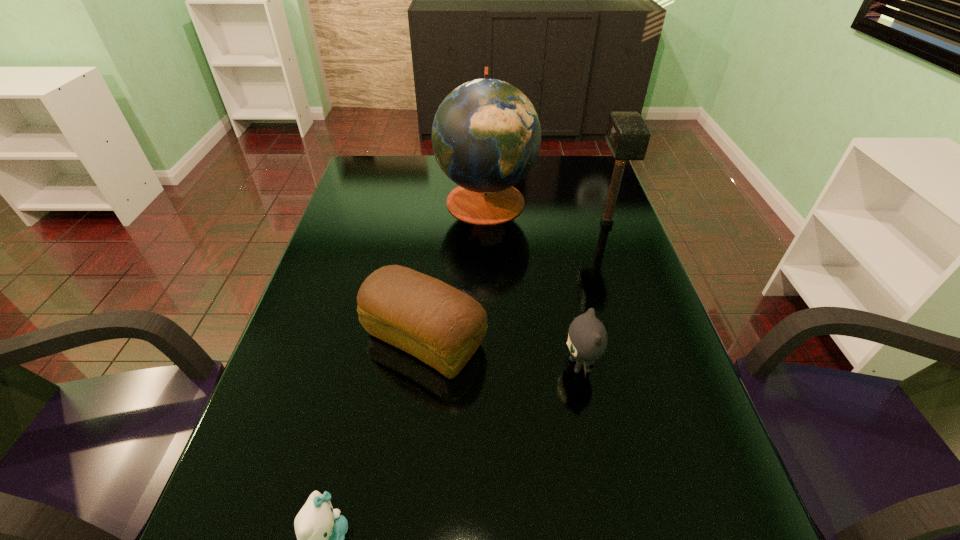
I want to click on globe, so click(x=486, y=135).

This screenshot has width=960, height=540. Find the location of `mallet`. mallet is located at coordinates (627, 135).

This screenshot has height=540, width=960. I want to click on the fourth shortest object, so click(627, 135).

Image resolution: width=960 pixels, height=540 pixels. Find the location of `the third tallest object`. the third tallest object is located at coordinates (442, 326).

The width and height of the screenshot is (960, 540). I want to click on the farther kitten, so click(x=587, y=339).

Where is `the second object from right to left`? the second object from right to left is located at coordinates (587, 339).

At what (x,y) coordinates should I click in order to perform the action: click on vacant space located with the Americas facing the viewer on the tallest object. Please return your answer as a coordinate pair (x, y). This screenshot has width=960, height=540. Looking at the image, I should click on (348, 200).

You are a GUI agent. You are given a task and a screenshot of the screen. Output one action in this format:
    pyautogui.click(x=<x>, y=<y>)
    Task: Click on the free location located with the Americas facing the viewer on the tallest object
    This screenshot has height=540, width=960.
    Given the screenshot: What is the action you would take?
    pyautogui.click(x=372, y=200)

I want to click on free location located 0.200m with the Americas facing the viewer on the tallest object, so coord(375,200).

Locate an element on the screen. The width and height of the screenshot is (960, 540). vacant space located 0.120m on the front of the second tallest object is located at coordinates (621, 264).